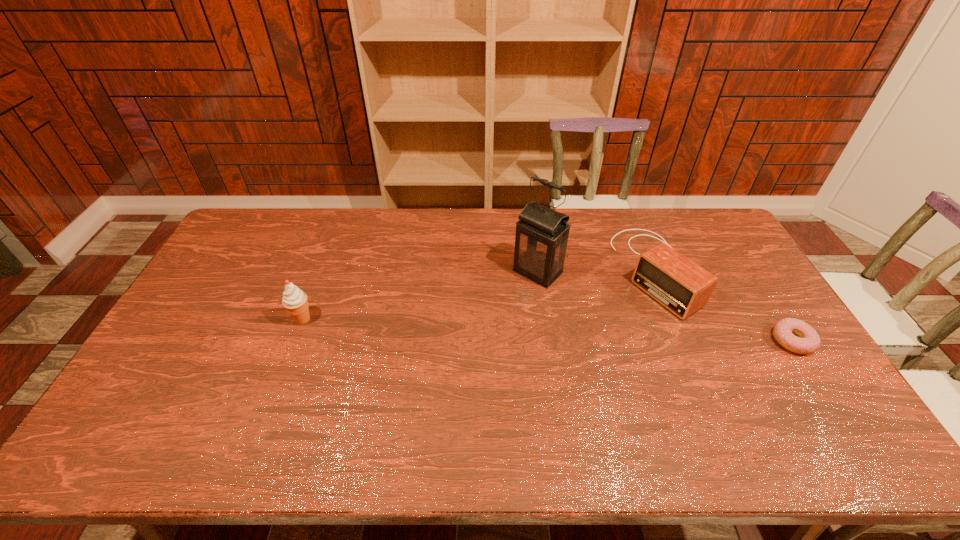
The image size is (960, 540). I want to click on vacant point located between the third object from right to left and the second shortest object, so click(x=595, y=271).

Where is `free area in between the rightmost object and the third object from left to right`? This screenshot has height=540, width=960. free area in between the rightmost object and the third object from left to right is located at coordinates (723, 306).

You are a GUI agent. You are given a task and a screenshot of the screen. Output one action in this format:
    pyautogui.click(x=<x>, y=<y>)
    Task: Click on the object that is the closest to the tallest object
    
    Given the screenshot: What is the action you would take?
    pyautogui.click(x=683, y=287)

Choose which object is the third nearest neighbor to the third object from left to right. Please provide its 2D coordinates. Your answer should be formatted as a tuple, i.e. [(x, y)], where the tuple contains the x and y coordinates of a point satisfying the conditions above.

[(294, 300)]

Image resolution: width=960 pixels, height=540 pixels. Identify the location of vacant space that satisfies the following two spatial constraints: 1. on the back side of the third object from right to left; 2. on the left side of the icecream. (321, 272).

At what (x,y) coordinates should I click in order to perform the action: click on free space that satisfies the following two spatial constraints: 1. on the back side of the radio receiver; 2. on the left side of the third shortest object. Please return your answer as a coordinate pair (x, y). The image size is (960, 540). Looking at the image, I should click on (321, 271).

Image resolution: width=960 pixels, height=540 pixels. In order to click on vacant area in the image that satisfies the following two spatial constraints: 1. on the back side of the second shortest object; 2. on the left side of the second object from left to right in this screenshot , I will do `click(539, 271)`.

I want to click on vacant space that satisfies the following two spatial constraints: 1. on the front side of the icecream; 2. on the left side of the rightmost object, so click(x=294, y=341).

At what (x,y) coordinates should I click in order to perform the action: click on blank space that satisfies the following two spatial constraints: 1. on the front side of the lantern; 2. on the left side of the rightmost object. Please return your answer as a coordinate pair (x, y). The width and height of the screenshot is (960, 540). Looking at the image, I should click on (548, 341).